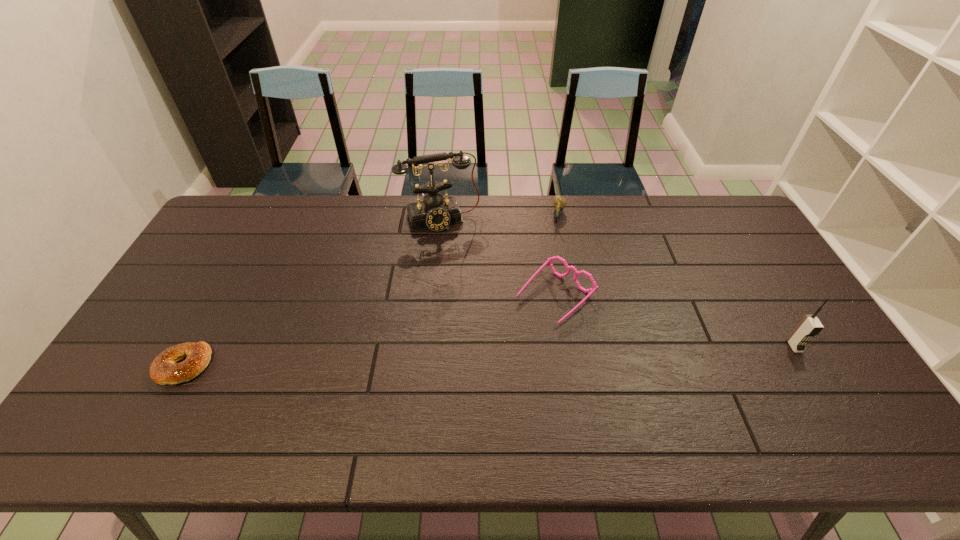
The width and height of the screenshot is (960, 540). I want to click on escargot that is at the far edge, so click(x=559, y=202).

You are a GUI agent. You are given a task and a screenshot of the screen. Output one action in this format:
    pyautogui.click(x=<x>, y=<y>)
    Task: Click on the object that is positioned at the near edge
    
    Given the screenshot: What is the action you would take?
    pyautogui.click(x=164, y=370)

Identify the location of object that is positioned at the left edge. (164, 370).

This screenshot has width=960, height=540. Identify the location of object at the right edge. (810, 325).

The height and width of the screenshot is (540, 960). I want to click on object that is at the near left corner, so click(164, 370).

Where is `vacant space at the far edge of the desktop`? This screenshot has width=960, height=540. vacant space at the far edge of the desktop is located at coordinates (364, 232).

Find the location of a particular element. vacant area at the near edge is located at coordinates (744, 377).

This screenshot has width=960, height=540. In the image, there is a desktop. Identify the location of vacant space at the left edge. (212, 265).

The height and width of the screenshot is (540, 960). In order to click on free spot at the right edge of the desktop in this screenshot , I will do `click(781, 304)`.

At what (x,y) coordinates should I click in order to perform the action: click on vacant position at the far left corner of the desktop. Please return your answer as a coordinate pair (x, y). Looking at the image, I should click on (208, 231).